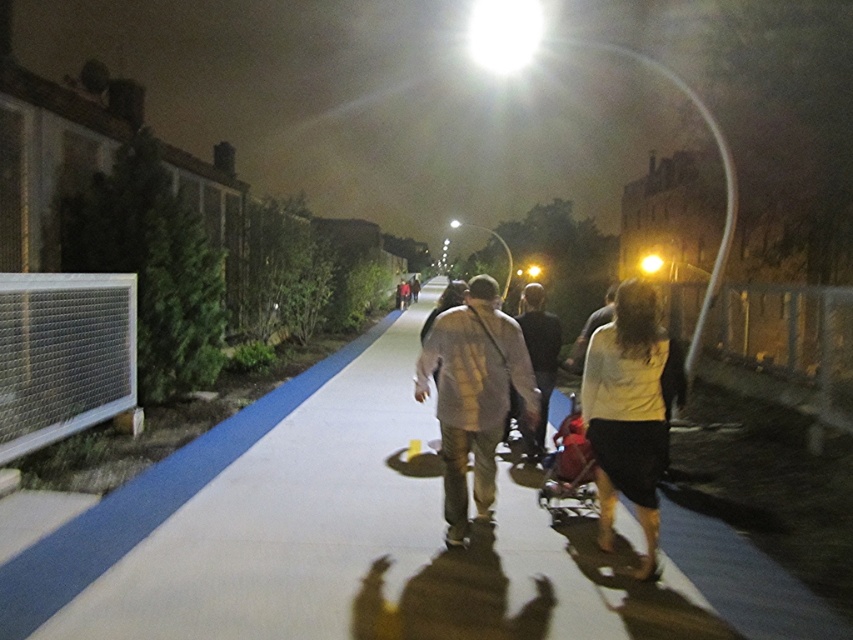
Which of these two, white matte shirt at center or white cotton shirt at center, stands taller?

With more height is white cotton shirt at center.

Does white matte shirt at center lie in front of white cotton shirt at center?

No, white matte shirt at center is further to the viewer.

At what (x,y) coordinates should I click in order to perform the action: click on white matte shirt at center. Please return your answer as a coordinate pair (x, y). This screenshot has height=640, width=853. Looking at the image, I should click on (630, 412).

Locate an element on the screen. The height and width of the screenshot is (640, 853). white matte shirt at center is located at coordinates (630, 412).

Can you confirm if blue smooth pavement at center is shorter than white cotton shirt at center?

Yes, blue smooth pavement at center is shorter than white cotton shirt at center.

Is blue smooth pavement at center further to camera compared to white cotton shirt at center?

No, it is not.

Locate an element on the screen. This screenshot has width=853, height=640. blue smooth pavement at center is located at coordinates (372, 540).

Does blue smooth pavement at center appear on the right side of white matte shirt at center?

In fact, blue smooth pavement at center is to the left of white matte shirt at center.

Between blue smooth pavement at center and white matte shirt at center, which one is positioned lower?

blue smooth pavement at center is below.

Image resolution: width=853 pixels, height=640 pixels. Identify the location of blue smooth pavement at center. (372, 540).